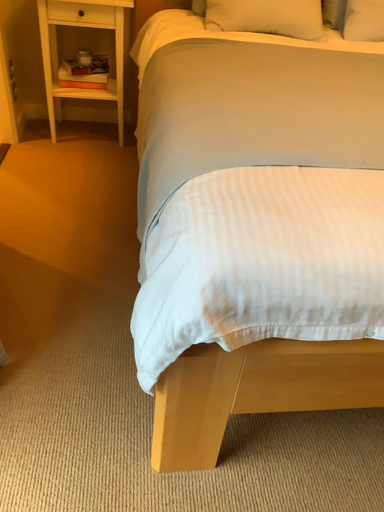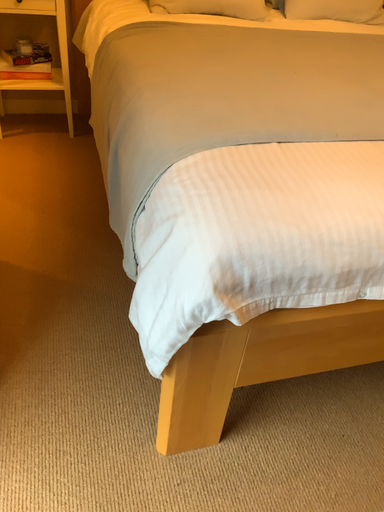
Question: Which way did the camera rotate in the video?

Choices:
 (A) rotated left
 (B) rotated right

Answer: (B)